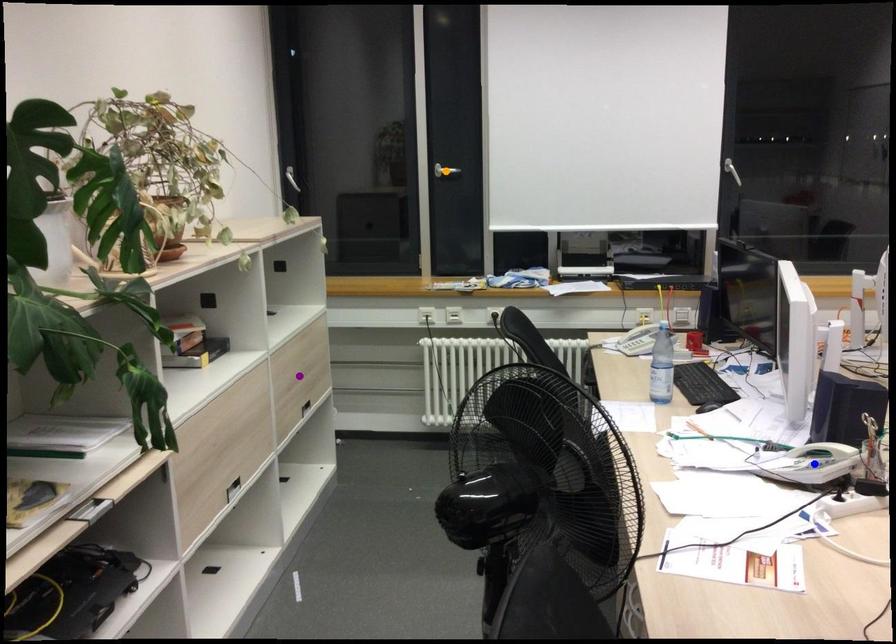
Looking at this image, order these from nearest to farthest:
1. orange point
2. blue point
3. purple point

blue point < purple point < orange point